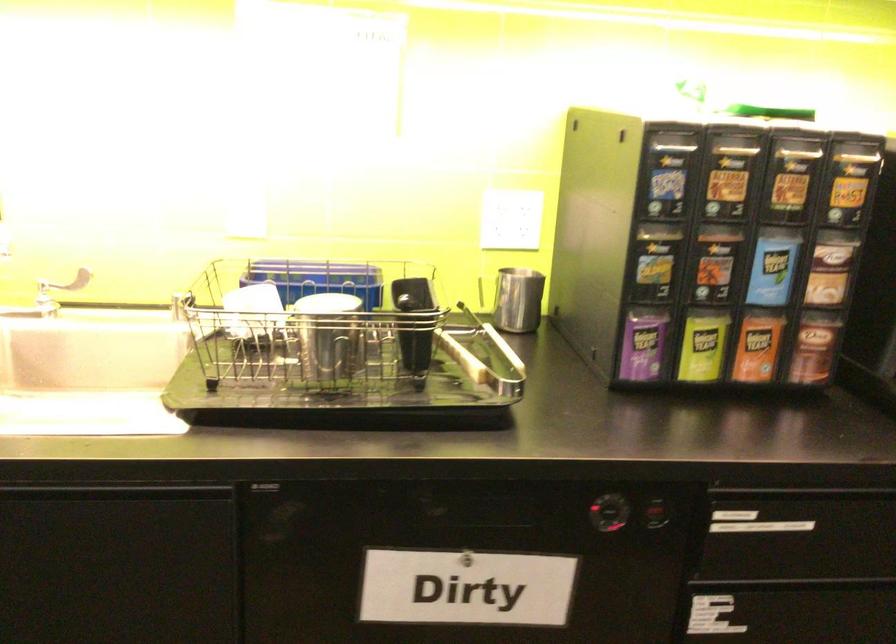
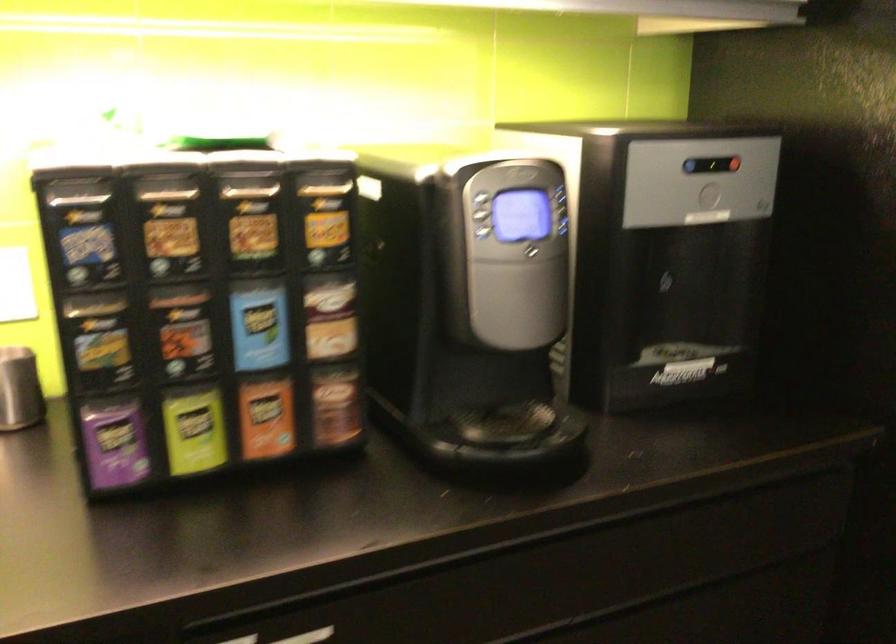
Find the pixel in the second image that matches point 814,348 in the first image.

(336, 406)